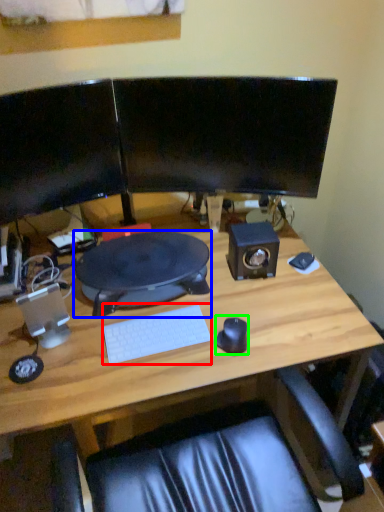
Question: Which object is the farthest from computer keyboard (highlighted by a red box)? Choose among these: desktop (highlighted by a blue box) or mouse (highlighted by a green box).

Choices:
 (A) desktop
 (B) mouse

Answer: (A)